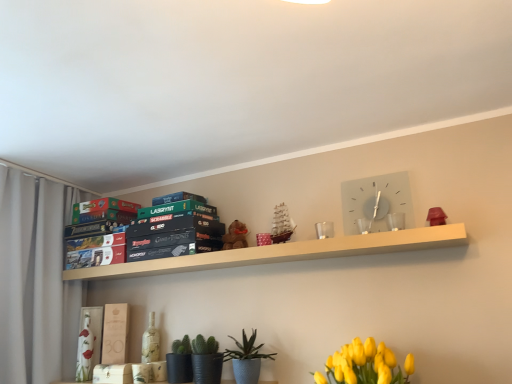
Question: Considering the relative sizes of yellow matte flower at lower right and brown plush bear at center in the image provided, is yellow matte flower at lower right bigger than brown plush bear at center?

Choices:
 (A) yes
 (B) no

Answer: (A)

Question: Does yellow matte flower at lower right lie behind brown plush bear at center?

Choices:
 (A) yes
 (B) no

Answer: (B)

Question: Is yellow matte flower at lower right taller than brown plush bear at center?

Choices:
 (A) yes
 (B) no

Answer: (A)

Question: Is yellow matte flower at lower right to the left of brown plush bear at center from the viewer's perspective?

Choices:
 (A) no
 (B) yes

Answer: (A)

Question: Is yellow matte flower at lower right outside of brown plush bear at center?

Choices:
 (A) yes
 (B) no

Answer: (A)

Question: Considering the relative positions of yellow matte flower at lower right and brown plush bear at center in the image provided, is yellow matte flower at lower right to the right of brown plush bear at center from the viewer's perspective?

Choices:
 (A) no
 (B) yes

Answer: (B)

Question: Does white glass clock at upper center come in front of green matte board game at upper center, the fourth paperback book when ordered from bottom to top?

Choices:
 (A) no
 (B) yes

Answer: (B)

Question: From the image's perspective, would you say white glass clock at upper center is shown under green matte board game at upper center, the fourth paperback book when ordered from bottom to top?

Choices:
 (A) no
 (B) yes

Answer: (A)

Question: Is white glass clock at upper center taller than green matte board game at upper center, the 1th paperback book in the top-to-bottom sequence?

Choices:
 (A) yes
 (B) no

Answer: (A)

Question: Considering the relative sizes of white glass clock at upper center and green matte board game at upper center, the 1th paperback book in the top-to-bottom sequence, in the image provided, is white glass clock at upper center smaller than green matte board game at upper center, the 1th paperback book in the top-to-bottom sequence,?

Choices:
 (A) no
 (B) yes

Answer: (B)

Question: Is white glass clock at upper center positioned with its back to green matte board game at upper center, the fourth paperback book when ordered from bottom to top?

Choices:
 (A) yes
 (B) no

Answer: (B)

Question: Considering the relative positions of white glass clock at upper center and green matte board game at upper center, the 1th paperback book in the top-to-bottom sequence, in the image provided, is white glass clock at upper center to the right of green matte board game at upper center, the 1th paperback book in the top-to-bottom sequence, from the viewer's perspective?

Choices:
 (A) yes
 (B) no

Answer: (A)

Question: From a real-world perspective, is green matte cactus at lower center, the 2th plant from the right, positioned over white fabric curtain at left based on gravity?

Choices:
 (A) yes
 (B) no

Answer: (B)